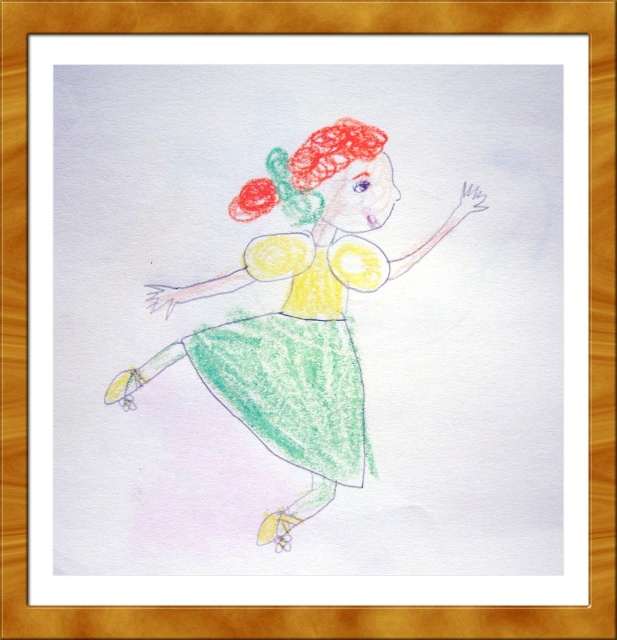
The image shows a child drawing of a dancing figure. The figure wears a pastel green dress at center and a pastel green crayon dress at center. Which dress is located to the left?

The pastel green dress at center is positioned on the left side of the pastel green crayon dress at center, so the pastel green dress at center is to the left.

You are standing 5 feet away from the image. The pastel green dress at center is part of a child drawing framed by a light brown border. Can you reach out and touch the dress if you extend your arm fully?

The pastel green dress at center is 4.35 feet away from the viewer. Since you are standing 5 feet away, extending your arm fully would not be enough to reach it as the distance is slightly farther than your arm length.

You are an art teacher helping a student who drew a figure with two dresses. The student wants to know which dress is visible on top. The two dresses are the pastel green dress at center and the pastel green crayon dress at center. Can you tell them?

The pastel green dress at center is positioned over the pastel green crayon dress at center, so the pastel green dress at center is visible on top.